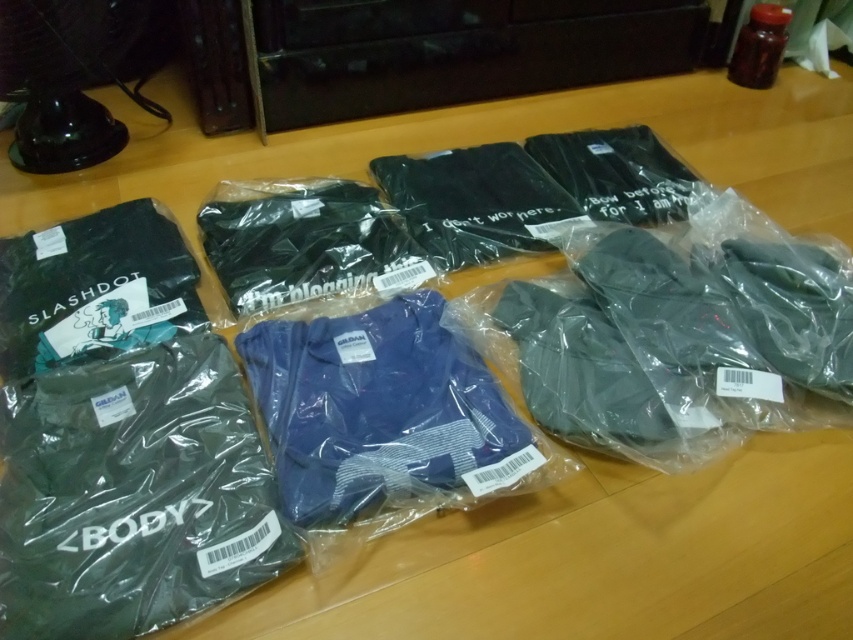
Who is higher up, matte black t-shirt at lower left or blue jersey at center?

Positioned higher is blue jersey at center.

Is matte black t-shirt at lower left to the left of blue jersey at center from the viewer's perspective?

Yes, matte black t-shirt at lower left is to the left of blue jersey at center.

This screenshot has width=853, height=640. Find the location of `matte black t-shirt at lower left`. matte black t-shirt at lower left is located at coordinates (132, 493).